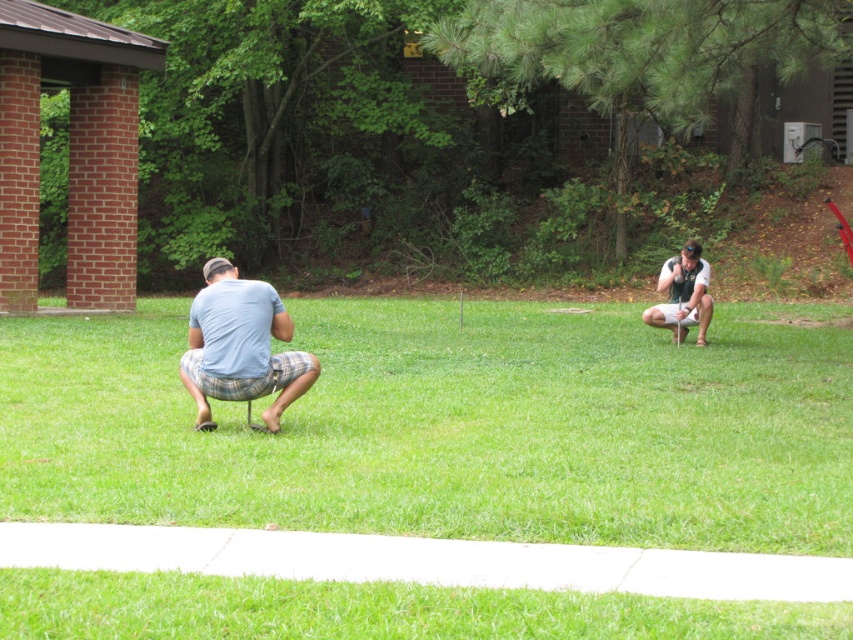
You are standing at the edge of the white concrete pathway and see the green grass at center and the white matte shirt at right. Which object is closer to your right side?

The white matte shirt at right is closer to your right side because it is positioned to the right of the green grass at center.

You are standing on the white concrete pathway at the bottom and looking towards the green grass at center and the white matte shirt at right. Which object is closer to you?

The green grass at center is closer to you because it has a lesser height compared to the white matte shirt at right, indicating it is nearer in the scene.